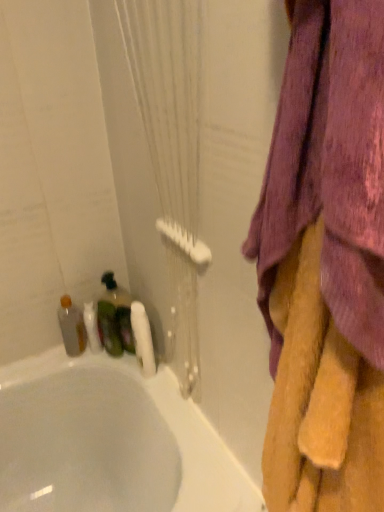
What do you see at coordinates (172, 149) in the screenshot? The width and height of the screenshot is (384, 512). I see `white textured shower curtain at left` at bounding box center [172, 149].

What is the approximate width of soft yellow towel at right?

soft yellow towel at right is 5.50 inches in width.

This screenshot has height=512, width=384. In order to click on translucent plastic bottle at lower left, which ranks as the 2th bottle in left-to-right order in this screenshot , I will do `click(114, 318)`.

How much space does translucent plastic bottle at lower left, which ranks as the 2th bottle in left-to-right order, occupy horizontally?

It is 6.09 inches.

This screenshot has height=512, width=384. What do you see at coordinates (142, 339) in the screenshot?
I see `white matte toilet paper at lower left` at bounding box center [142, 339].

Measure the distance between point (140,357) and camera.

Point (140,357) and camera are 1.12 meters apart.

Describe the element at coordinates (110, 441) in the screenshot. The image size is (384, 512). I see `white glossy bathtub at lower left` at that location.

This screenshot has width=384, height=512. In order to click on translucent plastic bottle at left, the second bottle when ordered from right to left in this screenshot , I will do `click(72, 327)`.

Is translucent plastic bottle at lower left, which ranks as the 2th bottle in left-to-right order, positioned far away from translucent plastic bottle at left, the second bottle when ordered from right to left?

They are positioned close to each other.

Which of these two, translucent plastic bottle at lower left, arranged as the first bottle when viewed from the right, or translucent plastic bottle at left, positioned as the 1th bottle in left-to-right order, is thinner?

With smaller width is translucent plastic bottle at left, positioned as the 1th bottle in left-to-right order.

Which of these two, translucent plastic bottle at lower left, arranged as the first bottle when viewed from the right, or translucent plastic bottle at left, the second bottle when ordered from right to left, is smaller?

With smaller size is translucent plastic bottle at left, the second bottle when ordered from right to left.

From a real-world perspective, which object stands above the other?

translucent plastic bottle at lower left, which ranks as the 2th bottle in left-to-right order.

Does white textured shower curtain at left come in front of white glossy bathtub at lower left?

Yes.

Is white textured shower curtain at left spatially inside white glossy bathtub at lower left, or outside of it?

white textured shower curtain at left exists outside the volume of white glossy bathtub at lower left.

Can you confirm if white textured shower curtain at left is wider than white glossy bathtub at lower left?

No, white textured shower curtain at left is not wider than white glossy bathtub at lower left.

In the image, is white textured shower curtain at left on the left side or the right side of white glossy bathtub at lower left?

Based on their positions, white textured shower curtain at left is located to the right of white glossy bathtub at lower left.

Based on the photo, which object is positioned more to the right, white matte toilet paper at lower left or translucent plastic bottle at lower left, which ranks as the 2th bottle in left-to-right order?

white matte toilet paper at lower left.

Is white matte toilet paper at lower left not inside translucent plastic bottle at lower left, arranged as the first bottle when viewed from the right?

Indeed, white matte toilet paper at lower left is completely outside translucent plastic bottle at lower left, arranged as the first bottle when viewed from the right.

Is point (147, 332) closer to viewer compared to point (122, 326)?

Yes, point (147, 332) is closer to viewer.

Could you measure the distance between white matte toilet paper at lower left and translucent plastic bottle at lower left, arranged as the first bottle when viewed from the right?

The distance of white matte toilet paper at lower left from translucent plastic bottle at lower left, arranged as the first bottle when viewed from the right, is 4.61 inches.

Can you confirm if white glossy bathtub at lower left is thinner than white textured shower curtain at left?

No, white glossy bathtub at lower left is not thinner than white textured shower curtain at left.

From the picture: Is white textured shower curtain at left surrounded by white glossy bathtub at lower left?

That's incorrect, white textured shower curtain at left is not inside white glossy bathtub at lower left.

From the image's perspective, is white glossy bathtub at lower left below white textured shower curtain at left?

Correct, white glossy bathtub at lower left appears lower than white textured shower curtain at left in the image.

Does point (35, 399) lie in front of point (187, 114)?

That is False.

From the image's perspective, between translucent plastic bottle at lower left, which ranks as the 2th bottle in left-to-right order, and purple fabric towel at upper right, who is located below?

From the image's view, translucent plastic bottle at lower left, which ranks as the 2th bottle in left-to-right order, is below.

Is translucent plastic bottle at lower left, arranged as the first bottle when viewed from the right, aimed at purple fabric towel at upper right?

No.

Where is `the 1st bottle to the left when counting from the purple fabric towel at upper right`? This screenshot has width=384, height=512. the 1st bottle to the left when counting from the purple fabric towel at upper right is located at coordinates (114, 318).

Looking at this image, is translucent plastic bottle at lower left, arranged as the first bottle when viewed from the right, placed right next to purple fabric towel at upper right?

No, translucent plastic bottle at lower left, arranged as the first bottle when viewed from the right, is not touching purple fabric towel at upper right.

What's the angular difference between translucent plastic bottle at lower left, which ranks as the 2th bottle in left-to-right order, and soft yellow towel at right's facing directions?

89.3 degrees separate the facing orientations of translucent plastic bottle at lower left, which ranks as the 2th bottle in left-to-right order, and soft yellow towel at right.

Between point (123, 295) and point (375, 508), which one is positioned in front?

The point (375, 508) is closer to the camera.

Is translucent plastic bottle at lower left, arranged as the first bottle when viewed from the right, taller than soft yellow towel at right?

No.

Can you confirm if translucent plastic bottle at left, the second bottle when ordered from right to left, is shorter than purple fabric towel at upper right?

Correct, translucent plastic bottle at left, the second bottle when ordered from right to left, is not as tall as purple fabric towel at upper right.

Could you tell me if translucent plastic bottle at left, positioned as the 1th bottle in left-to-right order, is facing purple fabric towel at upper right?

No.

How far apart are translucent plastic bottle at left, positioned as the 1th bottle in left-to-right order, and purple fabric towel at upper right?

The distance of translucent plastic bottle at left, positioned as the 1th bottle in left-to-right order, from purple fabric towel at upper right is 93.65 centimeters.

How many degrees apart are the facing directions of translucent plastic bottle at left, the second bottle when ordered from right to left, and purple fabric towel at upper right?

89.3 degrees.

Image resolution: width=384 pixels, height=512 pixels. Find the location of `bottle lying in front of the translucent plastic bottle at left, the second bottle when ordered from right to left`. bottle lying in front of the translucent plastic bottle at left, the second bottle when ordered from right to left is located at coordinates (114, 318).

You are a GUI agent. You are given a task and a screenshot of the screen. Output one action in this format:
    pyautogui.click(x=<x>, y=<y>)
    Task: Click on the shower curtain on the right of white glossy bathtub at lower left
    The image size is (384, 512).
    Given the screenshot: What is the action you would take?
    pyautogui.click(x=172, y=149)

When comparing their distances from purple fabric towel at upper right, does translucent plastic bottle at lower left, arranged as the first bottle when viewed from the right, or white glossy bathtub at lower left seem closer?

white glossy bathtub at lower left is closer to purple fabric towel at upper right.

Based on their spatial positions, is translucent plastic bottle at lower left, which ranks as the 2th bottle in left-to-right order, or white textured shower curtain at left closer to white glossy bathtub at lower left?

translucent plastic bottle at lower left, which ranks as the 2th bottle in left-to-right order, is closer to white glossy bathtub at lower left.

When comparing their distances from soft yellow towel at right, does translucent plastic bottle at left, the second bottle when ordered from right to left, or white glossy bathtub at lower left seem further?

The object further to soft yellow towel at right is translucent plastic bottle at left, the second bottle when ordered from right to left.

Estimate the real-world distances between objects in this image. Which object is further from soft yellow towel at right, white textured shower curtain at left or translucent plastic bottle at lower left, arranged as the first bottle when viewed from the right?

translucent plastic bottle at lower left, arranged as the first bottle when viewed from the right, is further to soft yellow towel at right.

Which object lies further to the anchor point translucent plastic bottle at lower left, arranged as the first bottle when viewed from the right, soft yellow towel at right or white textured shower curtain at left?

soft yellow towel at right.

Looking at the image, which one is located closer to purple fabric towel at upper right, translucent plastic bottle at lower left, which ranks as the 2th bottle in left-to-right order, or white textured shower curtain at left?

Based on the image, white textured shower curtain at left appears to be nearer to purple fabric towel at upper right.

Which object lies further to the anchor point purple fabric towel at upper right, translucent plastic bottle at left, positioned as the 1th bottle in left-to-right order, or white glossy bathtub at lower left?

translucent plastic bottle at left, positioned as the 1th bottle in left-to-right order, is further to purple fabric towel at upper right.

From the image, which object appears to be farther from translucent plastic bottle at lower left, which ranks as the 2th bottle in left-to-right order, soft yellow towel at right or white glossy bathtub at lower left?

The object further to translucent plastic bottle at lower left, which ranks as the 2th bottle in left-to-right order, is soft yellow towel at right.

Locate an element on the screen. The height and width of the screenshot is (512, 384). toilet paper that lies between white textured shower curtain at left and white glossy bathtub at lower left from top to bottom is located at coordinates (142, 339).

This screenshot has height=512, width=384. Identify the location of bathtub between purple fabric towel at upper right and white matte toilet paper at lower left from front to back. (110, 441).

Identify the location of bottle located between soft yellow towel at right and translucent plastic bottle at left, positioned as the 1th bottle in left-to-right order, in the depth direction. The image size is (384, 512). (114, 318).

Image resolution: width=384 pixels, height=512 pixels. Identify the location of toilet paper between translucent plastic bottle at lower left, arranged as the first bottle when viewed from the right, and white glossy bathtub at lower left vertically. (142, 339).